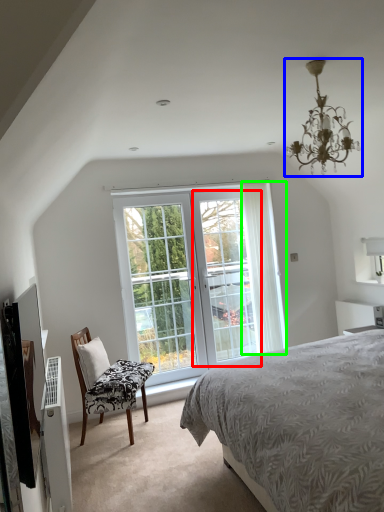
Question: Which object is positioned closest to screen door (highlighted by a red box)? Select from light fixture (highlighted by a blue box) and curtain (highlighted by a green box).

Choices:
 (A) light fixture
 (B) curtain

Answer: (B)